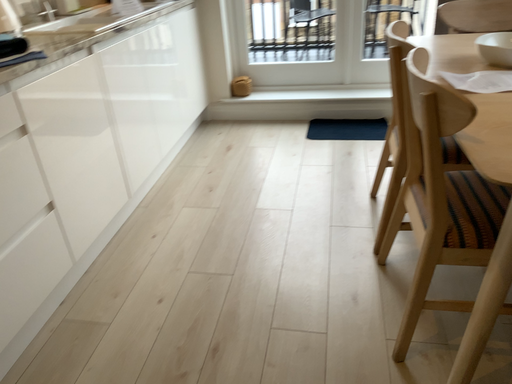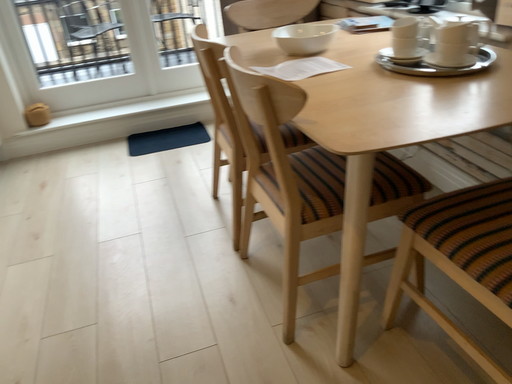
Question: How did the camera likely rotate when shooting the video?

Choices:
 (A) rotated right
 (B) rotated left

Answer: (A)